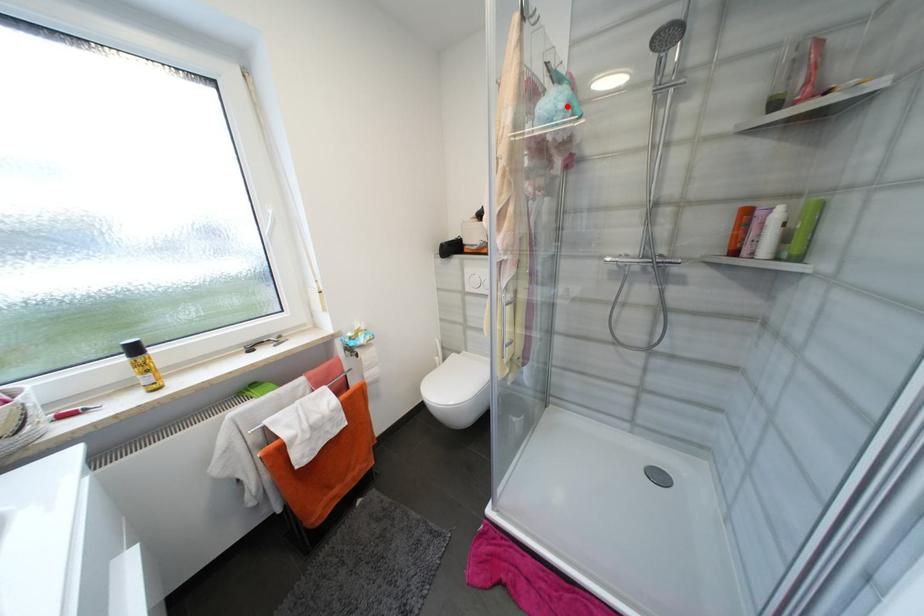
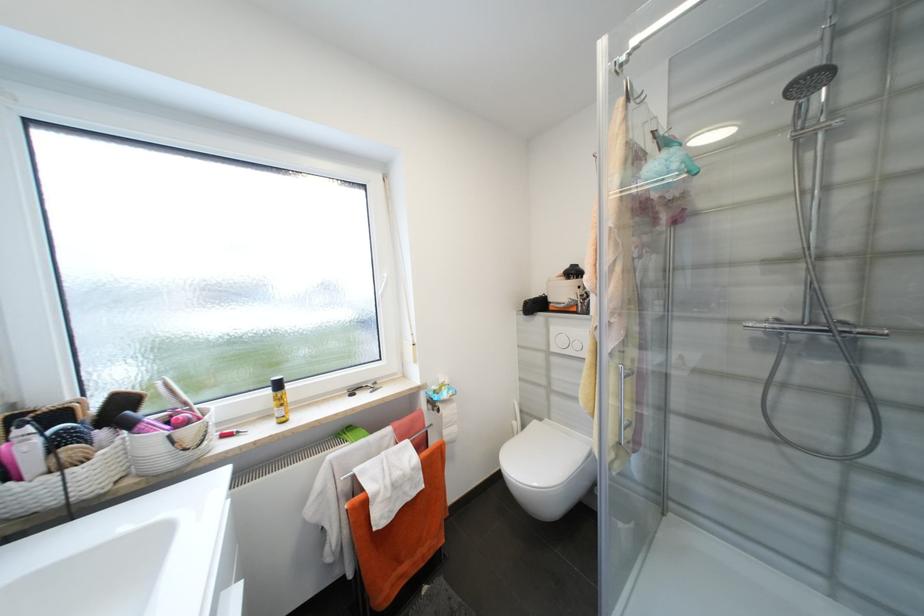
Locate, in the second image, the point that corresponds to the highlighted location in the first image.

(681, 167)